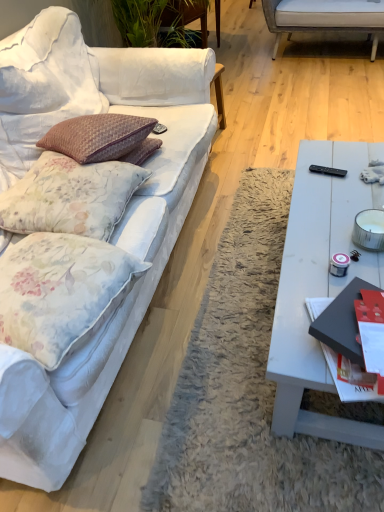
Question: From their relative heights in the image, would you say floral fabric pillow at left, which ranks as the 2th pillow in bottom-to-top order, is taller or shorter than white matte coffee table at right?

Choices:
 (A) tall
 (B) short

Answer: (B)

Question: From a real-world perspective, is floral fabric pillow at left, acting as the first pillow starting from the top, physically located above or below white matte coffee table at right?

Choices:
 (A) below
 (B) above

Answer: (B)

Question: Based on their relative distances, which object is farther from the black plastic remote control at right?

Choices:
 (A) white fabric couch at left
 (B) floral fabric pillow at left, which is the first pillow from bottom to top
 (C) white matte coffee table at right
 (D) red glossy magazine at right
 (E) floral fabric pillow at left, which ranks as the 2th pillow in bottom-to-top order

Answer: (B)

Question: Based on their relative distances, which object is farther from the floral fabric pillow at left, acting as the second pillow starting from the top?

Choices:
 (A) white fabric couch at left
 (B) black plastic remote control at right
 (C) white matte coffee table at right
 (D) floral fabric pillow at left, acting as the first pillow starting from the top
 (E) red glossy magazine at right

Answer: (B)